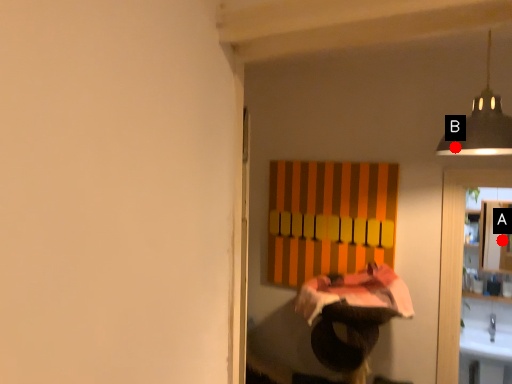
Question: Two points are circled on the image, labeled by A and B beside each circle. Which point appears closest to the camera in this image?

Choices:
 (A) A is closer
 (B) B is closer

Answer: (B)